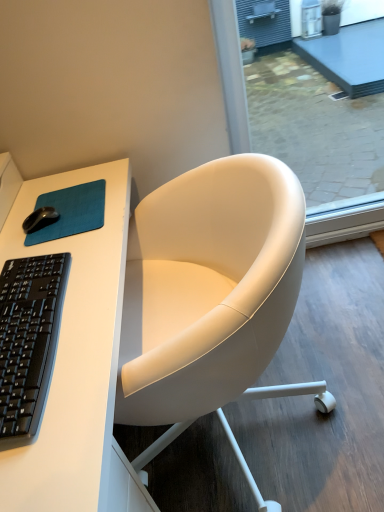
The image size is (384, 512). I want to click on blank space above white leather chair at center (from a real-world perspective), so click(309, 356).